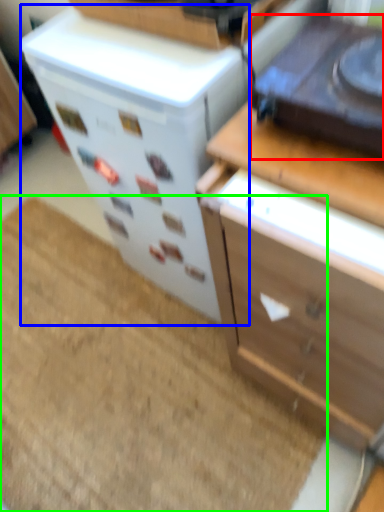
Question: Which object is the farthest from appliance (highlighted by a red box)? Choose among these: appliance (highlighted by a blue box) or doormat (highlighted by a green box).

Choices:
 (A) appliance
 (B) doormat

Answer: (B)